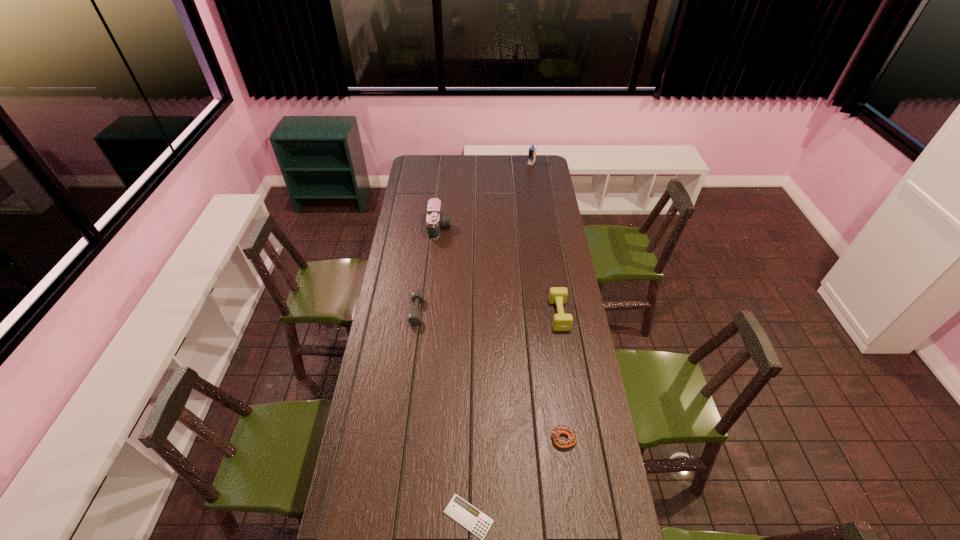
Locate an element on the screen. vacant area situated on the front of the right dumbbell is located at coordinates (564, 345).

Find the location of `vacant space situated on the front of the left dumbbell`. vacant space situated on the front of the left dumbbell is located at coordinates (406, 393).

You are a GUI agent. You are given a task and a screenshot of the screen. Output one action in this format:
    pyautogui.click(x=<x>, y=<y>)
    Task: Click on the vacant space located on the front of the doughnut
    
    Given the screenshot: What is the action you would take?
    pyautogui.click(x=568, y=472)

At what (x,y) coordinates should I click in order to perform the action: click on object that is positioned at the far edge. Please return your answer as a coordinate pair (x, y). Looking at the image, I should click on (532, 150).

The height and width of the screenshot is (540, 960). I want to click on object located in the left edge section of the desktop, so click(x=414, y=317).

At what (x,y) coordinates should I click in order to perform the action: click on orange_juice present at the right edge. Please return your answer as a coordinate pair (x, y). Looking at the image, I should click on pos(532,150).

Locate an element on the screen. dumbbell situated at the right edge is located at coordinates (557, 295).

Where is `doughnut present at the right edge`? The height and width of the screenshot is (540, 960). doughnut present at the right edge is located at coordinates (557, 430).

What are the coordinates of `object located at the far right corner` in the screenshot? It's located at (532, 150).

This screenshot has width=960, height=540. Find the location of `vacant space at the far edge`. vacant space at the far edge is located at coordinates (497, 160).